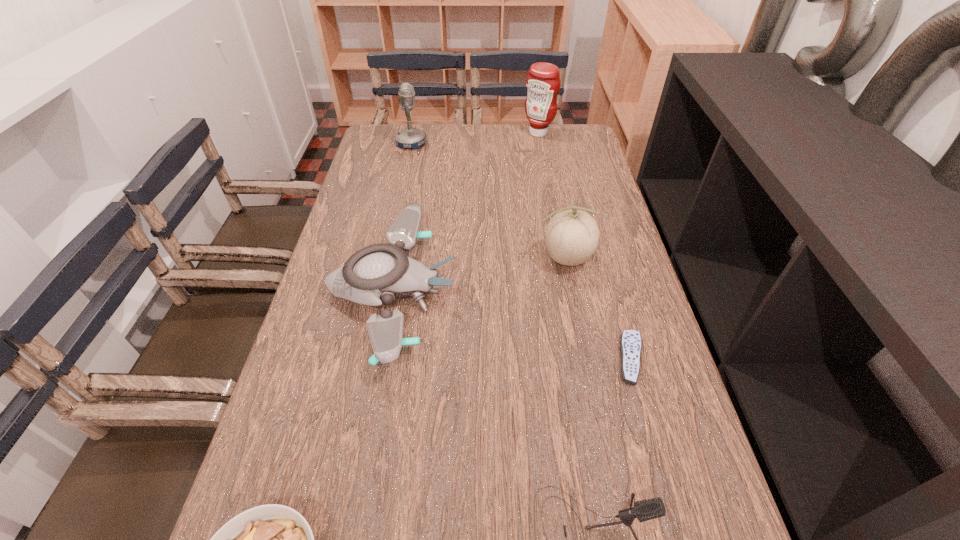
Locate an element on the screen. vacant space located 0.070m on the front of the shortest object is located at coordinates click(x=648, y=417).

At what (x,y) coordinates should I click in order to perform the action: click on condiment at the far edge. Please return your answer as a coordinate pair (x, y). The height and width of the screenshot is (540, 960). Looking at the image, I should click on (543, 83).

The image size is (960, 540). Find the location of `microphone present at the far edge`. microphone present at the far edge is located at coordinates coord(408,138).

This screenshot has height=540, width=960. Identify the location of microphone at the left edge. (408, 138).

Where is `drone situated at the left edge`? drone situated at the left edge is located at coordinates (374, 275).

Identify the location of condiment that is positioned at the right edge. (543, 83).

The width and height of the screenshot is (960, 540). Identify the location of cantaloup located in the right edge section of the desktop. (571, 237).

Where is `remote control located in the right edge section of the desktop`? The width and height of the screenshot is (960, 540). remote control located in the right edge section of the desktop is located at coordinates (630, 343).

This screenshot has width=960, height=540. Identify the location of object that is at the far left corner. (408, 138).

Locate an element on the screen. The width and height of the screenshot is (960, 540). object that is positioned at the far right corner is located at coordinates (543, 83).